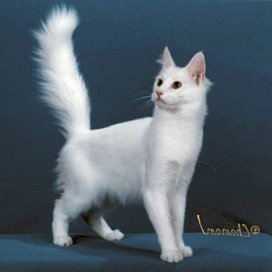
You are a GUI agent. You are given a task and a screenshot of the screen. Output one action in this format:
    pyautogui.click(x=<x>, y=<y>)
    Task: Click on the chest
    This screenshot has width=272, height=272.
    Given the screenshot: What is the action you would take?
    pyautogui.click(x=183, y=152)